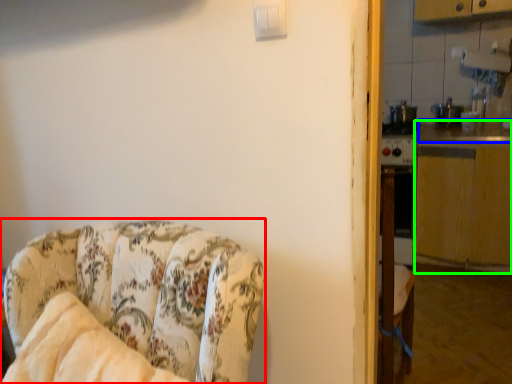
Question: Which is farther away from chair (highlighted by a red box)? counter top (highlighted by a blue box) or counter top (highlighted by a green box)?

Choices:
 (A) counter top
 (B) counter top

Answer: (A)